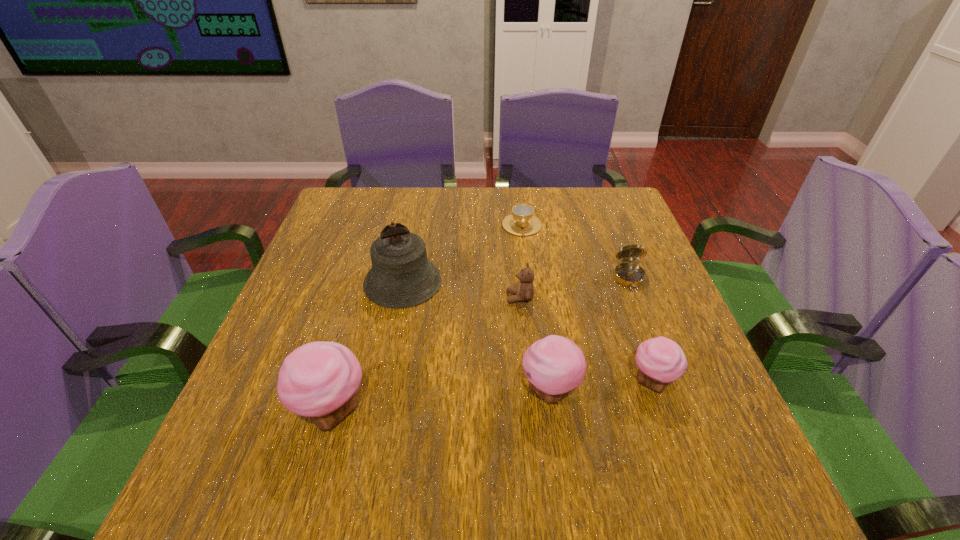
Select which cupcake appears as the closest to the teddy bear. Please provide its 2D coordinates. Your answer should be formatted as a tuple, i.e. [(x, y)], where the tuple contains the x and y coordinates of a point satisfying the conditions above.

[(555, 365)]

Image resolution: width=960 pixels, height=540 pixels. What are the coordinates of `cupcake object that ranks as the closest to the rightmost cupcake` in the screenshot? It's located at (555, 365).

This screenshot has height=540, width=960. In order to click on free space that satisfies the following two spatial constraints: 1. with the handle on the side of the shortest cupcake; 2. on the left side of the farthest object in this screenshot , I will do click(541, 382).

This screenshot has width=960, height=540. I want to click on vacant region that satisfies the following two spatial constraints: 1. on the front side of the rightmost cupcake; 2. on the right side of the bell, so click(383, 382).

Locate an element on the screen. The height and width of the screenshot is (540, 960). free location that satisfies the following two spatial constraints: 1. on the front side of the bell; 2. on the right side of the second shortest cupcake is located at coordinates (381, 391).

Identify the location of free space that satisfies the following two spatial constraints: 1. with the handle on the side of the shortest cupcake; 2. on the right side of the cup. (541, 382).

Locate an element on the screen. Image resolution: width=960 pixels, height=540 pixels. free space that satisfies the following two spatial constraints: 1. with the dial facing the compass; 2. on the front-facing side of the teddy bear is located at coordinates (636, 298).